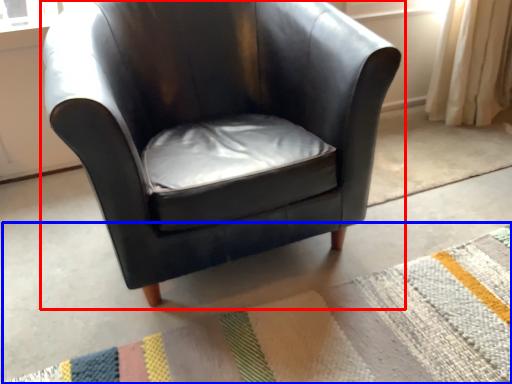
Question: Which point is closer to the camera, chair (highlighted by a red box) or mat (highlighted by a blue box)?

Choices:
 (A) chair
 (B) mat

Answer: (B)